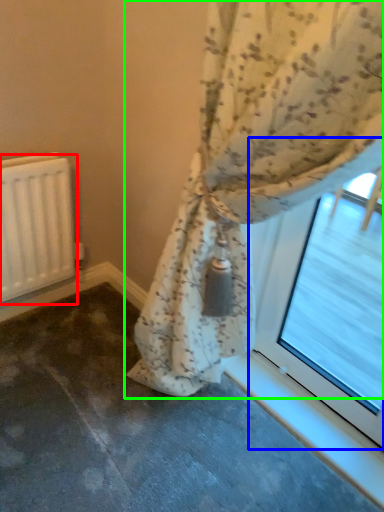
Question: Which object is positioned farthest from radiator (highlighted by a red box)? Select from bay window (highlighted by a blue box) and curtain (highlighted by a green box).

Choices:
 (A) bay window
 (B) curtain

Answer: (A)